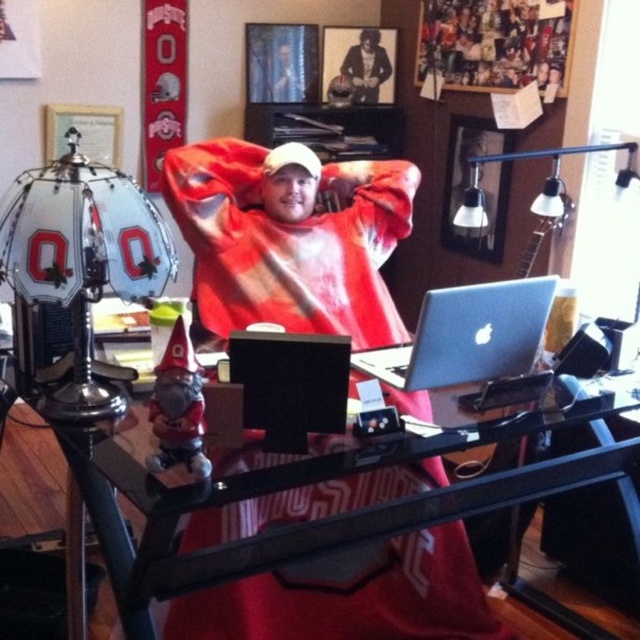
The height and width of the screenshot is (640, 640). I want to click on transparent glass table at center, so click(x=32, y=476).

Does transparent glass table at center have a lesser width compared to black plastic laptop at center?

No.

Is point (19, 449) closer to viewer compared to point (326, 413)?

No, (19, 449) is further to viewer.

At what (x,y) coordinates should I click in order to perform the action: click on transparent glass table at center. Please return your answer as a coordinate pair (x, y). This screenshot has width=640, height=640. Looking at the image, I should click on (32, 476).

Is silver metallic laptop at center taller than black plastic laptop at center?

Indeed, silver metallic laptop at center has a greater height compared to black plastic laptop at center.

You are a GUI agent. You are given a task and a screenshot of the screen. Output one action in this format:
    pyautogui.click(x=<x>, y=<y>)
    Task: Click on the silver metallic laptop at center
    
    Given the screenshot: What is the action you would take?
    pyautogui.click(x=467, y=337)

Which is more to the left, black plastic laptop at center or shiny black leather jacket at upper center?

From the viewer's perspective, black plastic laptop at center appears more on the left side.

Is point (310, 340) farther from camera compared to point (376, 64)?

No, it is in front of (376, 64).

The height and width of the screenshot is (640, 640). Find the location of `black plastic laptop at center`. black plastic laptop at center is located at coordinates (291, 380).

Find the location of `black plastic laptop at center`. black plastic laptop at center is located at coordinates (291, 380).